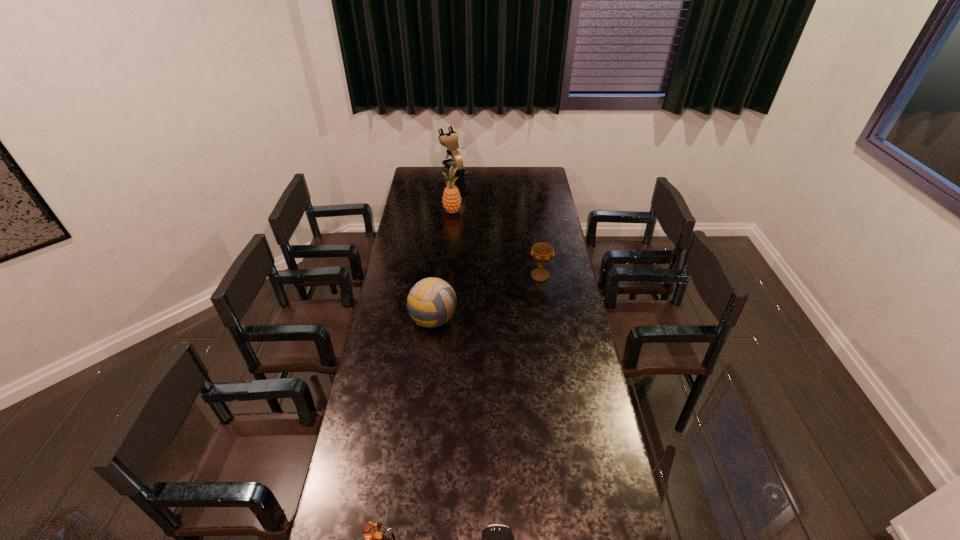
Identify the location of microscope. (449, 140).

Where is `the fifth nearest object`? The image size is (960, 540). the fifth nearest object is located at coordinates (451, 197).

Where is `volleyball`? volleyball is located at coordinates (431, 302).

Image resolution: width=960 pixels, height=540 pixels. Identify the location of the fourth farthest object. (431, 302).

Locate an element on the screen. The width and height of the screenshot is (960, 540). the rightmost object is located at coordinates (542, 252).

I want to click on the third shortest object, so click(542, 252).

The width and height of the screenshot is (960, 540). I want to click on vacant space located on the front of the microscope, so click(x=454, y=196).

You are a GUI agent. You are given a task and a screenshot of the screen. Output one action in this format:
    pyautogui.click(x=<x>, y=<y>)
    Task: Click on the free space located on the right of the fifth nearest object
    The width and height of the screenshot is (960, 540).
    Given the screenshot: What is the action you would take?
    pyautogui.click(x=487, y=212)

Image resolution: width=960 pixels, height=540 pixels. In order to click on free region located 0.390m on the front of the third tallest object in this screenshot , I will do `click(422, 420)`.

The width and height of the screenshot is (960, 540). I want to click on free region located on the back of the fourth nearest object, so click(535, 244).